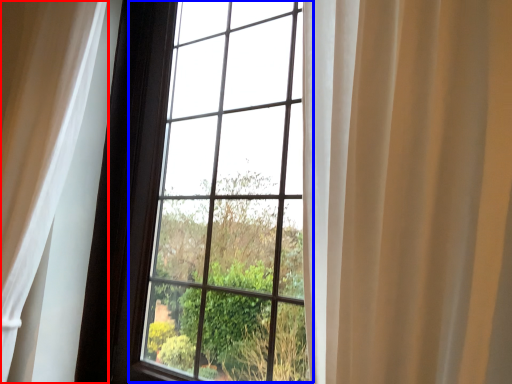
Question: Which object appears farthest to the camera in this image, curtain (highlighted by a red box) or bay window (highlighted by a blue box)?

Choices:
 (A) curtain
 (B) bay window

Answer: (A)